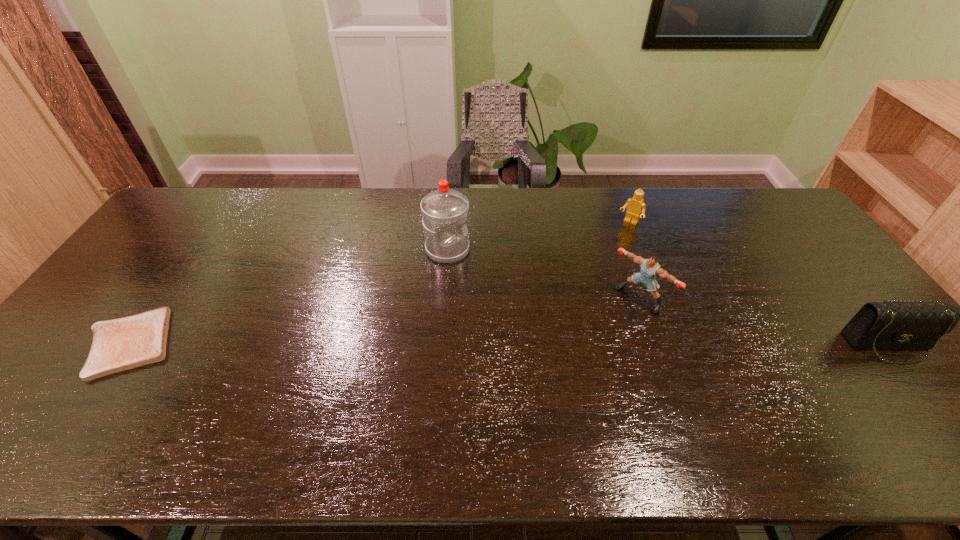
Find the location of a particular element. Image resolution: width=960 pixels, height=540 pixels. the shortest object is located at coordinates (120, 344).

The height and width of the screenshot is (540, 960). I want to click on the leftmost object, so click(120, 344).

Where is `the rightmost object`? The height and width of the screenshot is (540, 960). the rightmost object is located at coordinates (897, 324).

At what (x,y) coordinates should I click in order to perform the action: click on puncher. Please return your answer as a coordinate pair (x, y). Looking at the image, I should click on (650, 268).

At what (x,y) coordinates should I click in order to perform the action: click on the farthest object. Please return your answer as a coordinate pair (x, y). The width and height of the screenshot is (960, 540). Looking at the image, I should click on (635, 205).

At what (x,y) coordinates should I click in order to perform the action: click on the tallest object. Please return your answer as a coordinate pair (x, y). Looking at the image, I should click on (444, 211).

The image size is (960, 540). I want to click on the fourth object from right to left, so point(444,211).

Locate an element on the screen. Image resolution: width=960 pixels, height=540 pixels. vacant space located 0.330m on the back of the leftmost object is located at coordinates (204, 234).

Identify the location of free space located 0.060m on the front flap of the clutch bag. (921, 386).

Where is `vacant space located on the front-facing side of the fourth shortest object`? This screenshot has height=540, width=960. vacant space located on the front-facing side of the fourth shortest object is located at coordinates (578, 355).